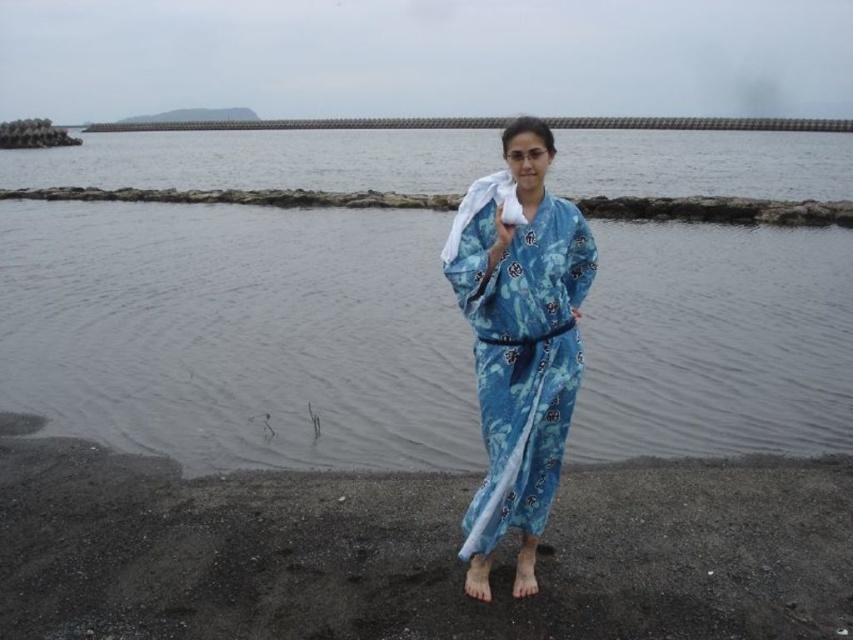
Question: Is clear water at center positioned in front of black sand at lower center?

Choices:
 (A) yes
 (B) no

Answer: (B)

Question: Which object is the closest to the blue floral kimono at center?

Choices:
 (A) black sand at lower center
 (B) clear water at center

Answer: (A)

Question: Among these points, which one is nearest to the camera?

Choices:
 (A) tap(527, 321)
 (B) tap(260, 172)

Answer: (A)

Question: Where is clear water at center located in relation to black sand at lower center in the image?

Choices:
 (A) left
 (B) right

Answer: (A)

Question: Does clear water at center lie in front of blue floral kimono at center?

Choices:
 (A) yes
 (B) no

Answer: (B)

Question: Considering the real-world distances, which object is closest to the black sand at lower center?

Choices:
 (A) blue floral kimono at center
 (B) clear water at center

Answer: (A)